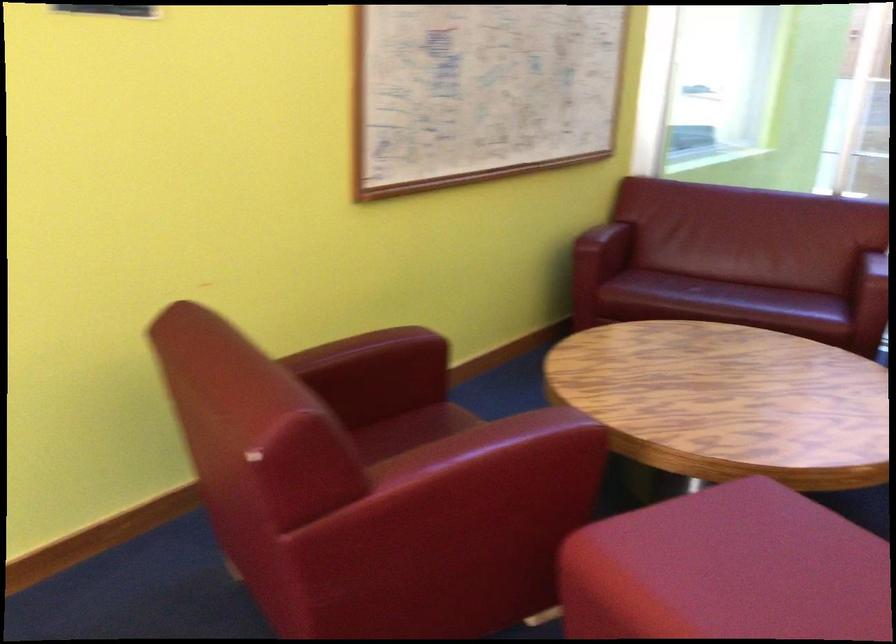
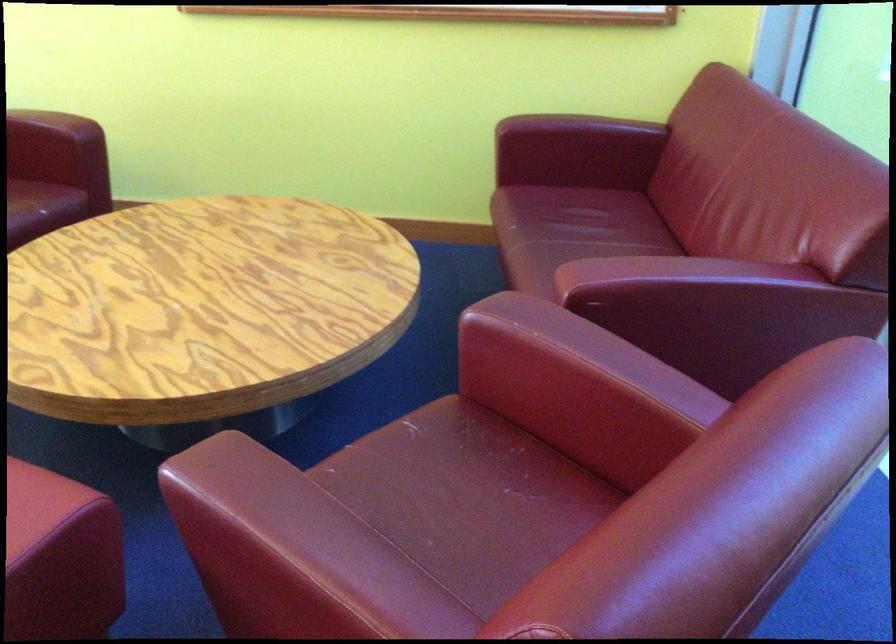
Question: I am providing you with two images of the same scene from different viewpoints. After the viewpoint changes to image2, which objects are now occluded?

Choices:
 (A) red chair armrest
 (B) red chair sitting surface
 (C) sofa armrest
 (D) packaged container stack

Answer: (C)